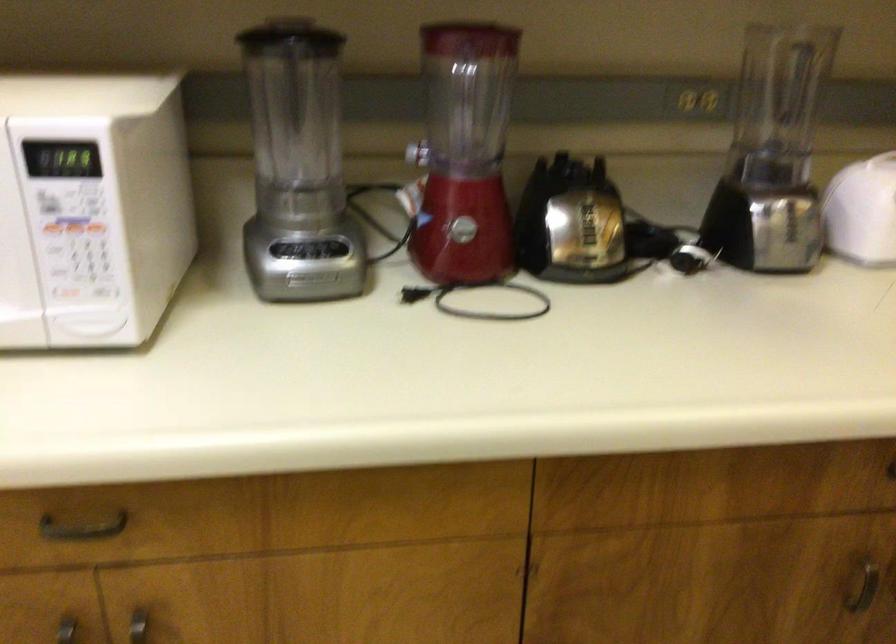
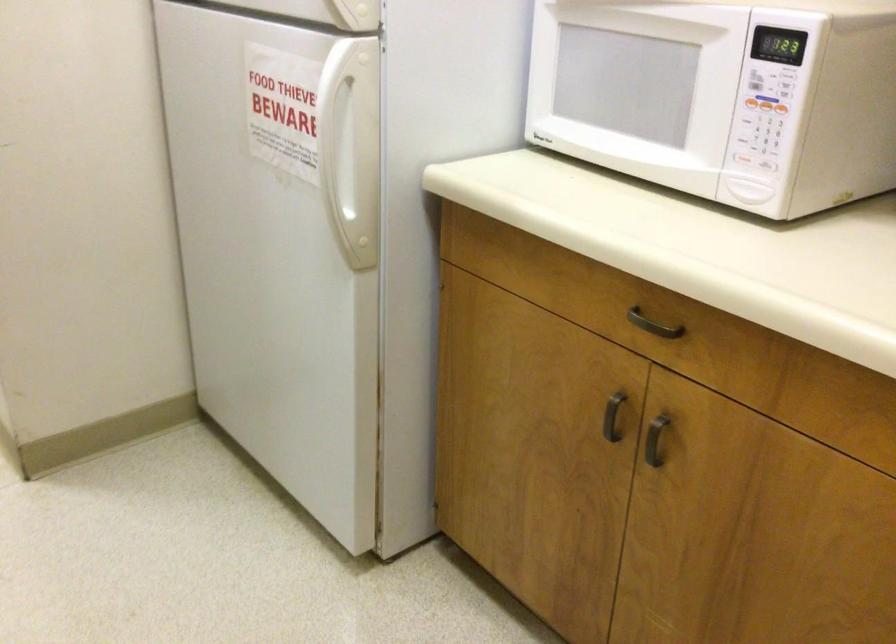
In the second image, find the point that corresponds to (80,535) in the first image.

(652, 325)